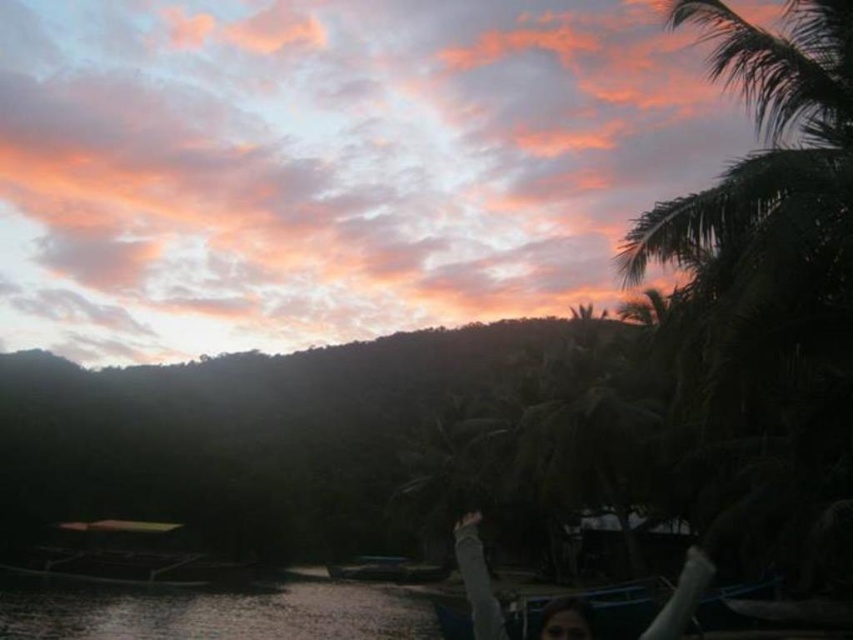
You are standing on the shore and want to cross to the other side of the metallic blue boat at center. The clear water at lower left is your only path. Considering their widths, which one is wider to walk on?

The clear water at lower left is wider than the metallic blue boat at center, so it is the wider path to walk on.

You are standing on the beach and see the clear water at lower left and the smooth skin person at lower center. Which object is closer to the left edge of the image?

The clear water at lower left is positioned on the left side of the smooth skin person at lower center, so it is closer to the left edge of the image.